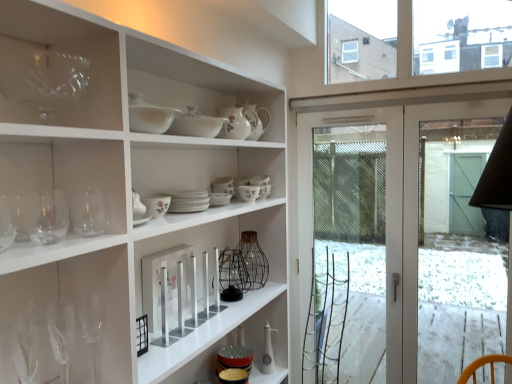
Question: Is white ceramic bowl at upper center, which is the second tableware in front-to-back order, smaller than transparent glass at upper left?

Choices:
 (A) yes
 (B) no

Answer: (A)

Question: From a real-world perspective, is white ceramic bowl at upper center, which is the second tableware in front-to-back order, over transparent glass at upper left?

Choices:
 (A) yes
 (B) no

Answer: (B)

Question: Is white ceramic bowl at upper center, the 6th tableware positioned from the bottom, thinner than transparent glass at upper left?

Choices:
 (A) yes
 (B) no

Answer: (B)

Question: Can transparent glass at upper left be found inside white ceramic bowl at upper center, which is counted as the 2th tableware, starting from the top?

Choices:
 (A) yes
 (B) no

Answer: (B)

Question: Is white ceramic bowl at upper center, placed as the 6th tableware when sorted from back to front, aimed at transparent glass at upper left?

Choices:
 (A) yes
 (B) no

Answer: (B)

Question: From a real-world perspective, is transparent glass wine glass at left, the second wine glass from the back, above or below transparent glass screen door at right?

Choices:
 (A) below
 (B) above

Answer: (B)

Question: In the image, is transparent glass wine glass at left, the second wine glass from the back, positioned in front of or behind transparent glass screen door at right?

Choices:
 (A) behind
 (B) front

Answer: (B)

Question: From the image's perspective, relative to transparent glass screen door at right, is transparent glass wine glass at left, positioned as the fourth wine glass in front-to-back order, above or below?

Choices:
 (A) above
 (B) below

Answer: (A)

Question: Would you say transparent glass wine glass at left, the second wine glass from the back, is inside or outside transparent glass screen door at right?

Choices:
 (A) inside
 (B) outside

Answer: (B)

Question: In terms of height, does floral ceramic bowl at center, the second tableware when ordered from back to front, look taller or shorter compared to transparent glass screen door at right?

Choices:
 (A) tall
 (B) short

Answer: (B)

Question: Considering the positions of floral ceramic bowl at center, the second tableware when ordered from back to front, and transparent glass screen door at right in the image, is floral ceramic bowl at center, the second tableware when ordered from back to front, wider or thinner than transparent glass screen door at right?

Choices:
 (A) thin
 (B) wide

Answer: (B)

Question: Considering the positions of point (260, 178) and point (500, 248), is point (260, 178) closer or farther from the camera than point (500, 248)?

Choices:
 (A) farther
 (B) closer

Answer: (B)

Question: From a real-world perspective, is floral ceramic bowl at center, the second tableware when ordered from back to front, physically located above or below transparent glass screen door at right?

Choices:
 (A) below
 (B) above

Answer: (B)

Question: From a real-world perspective, relative to white ceramic bowl at upper center, which is counted as the 2th tableware, starting from the top, is white ceramic bowl at upper center, the 1th tableware in the front-to-back sequence, vertically above or below?

Choices:
 (A) above
 (B) below

Answer: (A)

Question: Is point (129, 109) positioned closer to the camera than point (179, 115)?

Choices:
 (A) farther
 (B) closer

Answer: (B)